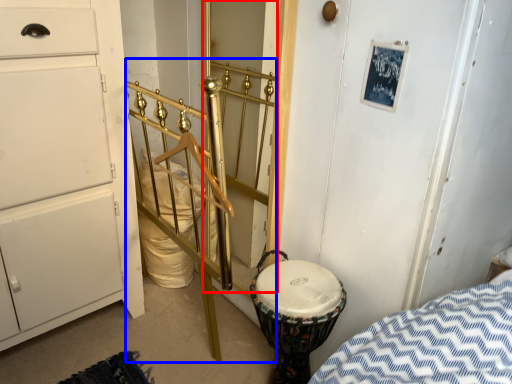
Question: Which of the following is the closest to the observer, door (highlighted by a red box) or rail (highlighted by a blue box)?

Choices:
 (A) door
 (B) rail

Answer: (B)